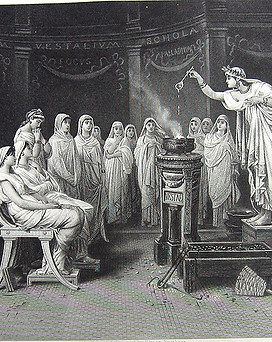
Identify the location of tile floor. This screenshot has width=272, height=342. (158, 325).